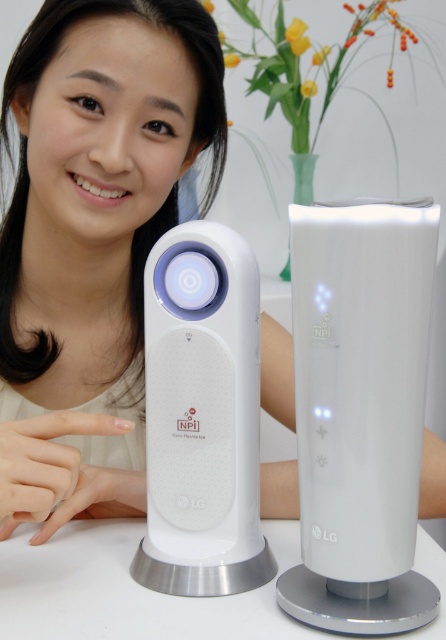
Based on the photo, you are setting up a desk and need to place the white glossy tower at center and the white glossy speaker at center. Which one should you place first if you want the shorter item to be placed before the taller one?

You should place the white glossy tower at center first because it is shorter than the white glossy speaker at center.

You are setting up a small audio system in a living room. You have a white glossy speaker at center and a white glossy table at center. Which object should you place on top of the other to ensure stability?

The white glossy speaker at center is smaller than the white glossy table at center, so placing the speaker on top of the table would provide a stable base for the speaker.